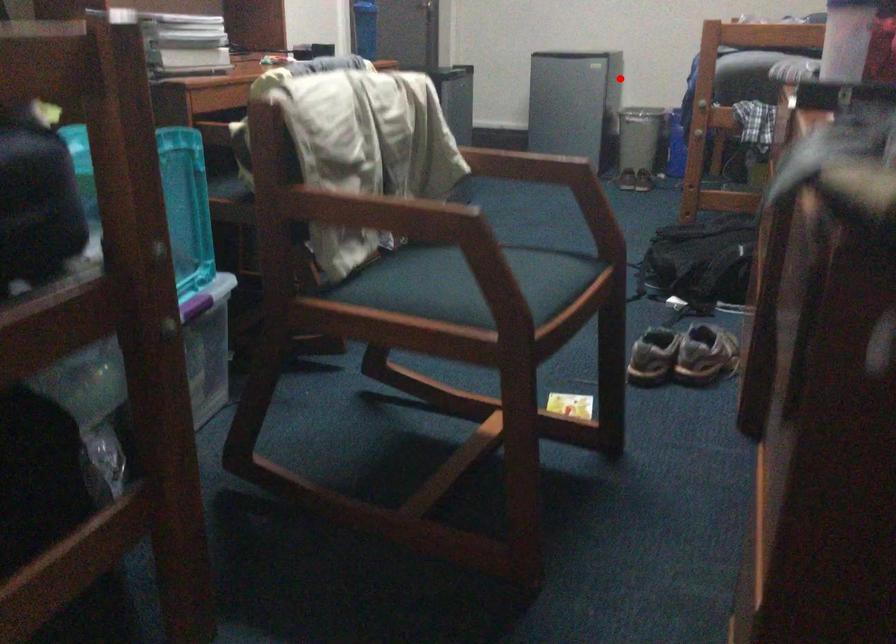
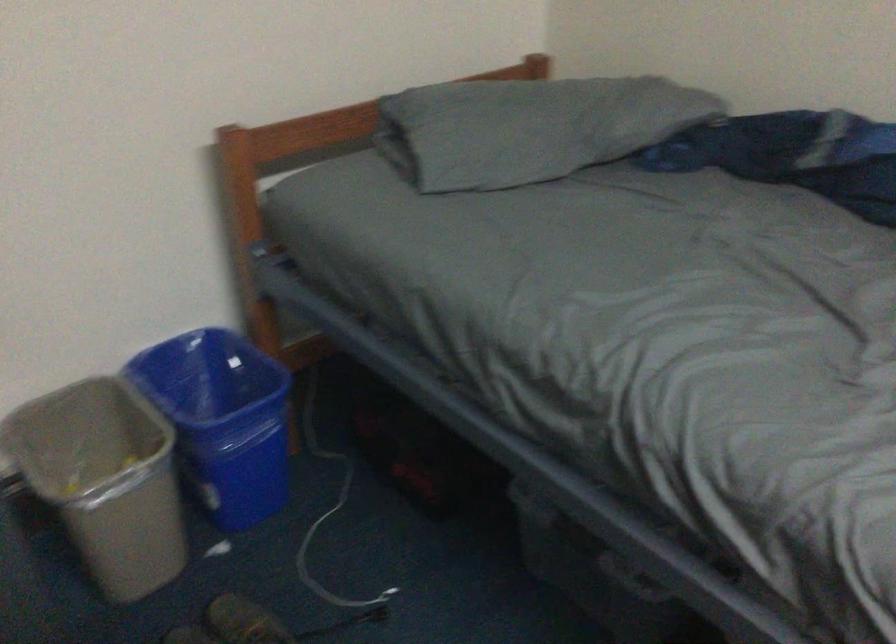
Find the pixel in the second image that matches the highlighted location in the first image.

(104, 480)